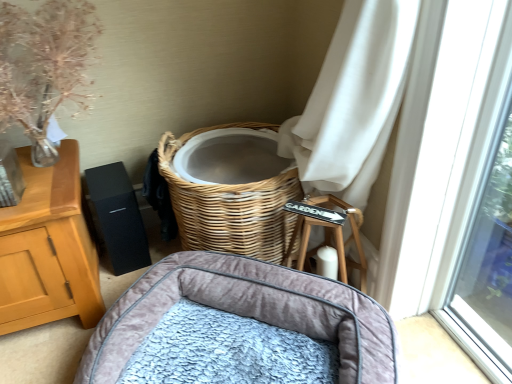
Question: Is translucent glass vase at upper left in front of or behind velvet grey pet bed at lower center in the image?

Choices:
 (A) behind
 (B) front

Answer: (A)

Question: Is translucent glass vase at upper left taller or shorter than velvet grey pet bed at lower center?

Choices:
 (A) short
 (B) tall

Answer: (B)

Question: Is translucent glass vase at upper left bigger or smaller than velvet grey pet bed at lower center?

Choices:
 (A) small
 (B) big

Answer: (A)

Question: Considering their positions, is velvet grey pet bed at lower center located in front of or behind translucent glass vase at upper left?

Choices:
 (A) front
 (B) behind

Answer: (A)

Question: From a real-world perspective, is velvet grey pet bed at lower center positioned above or below translucent glass vase at upper left?

Choices:
 (A) above
 (B) below

Answer: (B)

Question: Does point click(x=186, y=294) appear closer or farther from the camera than point click(x=56, y=97)?

Choices:
 (A) closer
 (B) farther

Answer: (B)

Question: Based on their positions, is velvet grey pet bed at lower center located to the left or right of translucent glass vase at upper left?

Choices:
 (A) left
 (B) right

Answer: (B)